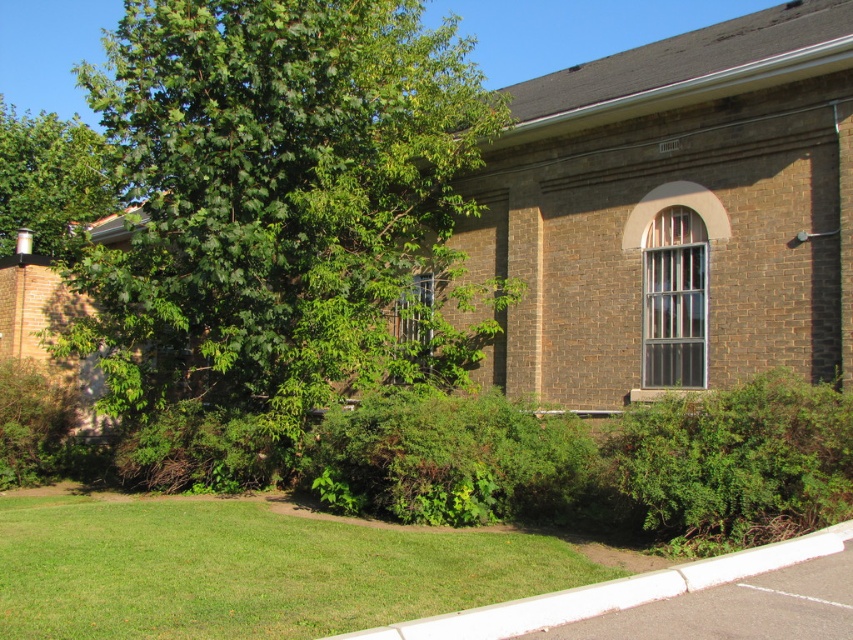
Question: Which object is positioned farthest from the green leafy bush at center?

Choices:
 (A) green grass at lower center
 (B) white concrete curb at lower center

Answer: (B)

Question: Where is green leafy bush at lower right located in relation to white concrete curb at lower center in the image?

Choices:
 (A) right
 (B) left

Answer: (A)

Question: Which object appears closest to the camera in this image?

Choices:
 (A) green leafy bush at lower right
 (B) green leafy tree at center
 (C) green grass at lower center
 (D) green leafy bush at center

Answer: (C)

Question: Does green leafy tree at center appear on the right side of green leafy bush at lower right?

Choices:
 (A) no
 (B) yes

Answer: (A)

Question: Which object appears farthest from the camera in this image?

Choices:
 (A) green leafy tree at upper left
 (B) green leafy bush at center
 (C) green leafy bush at lower right

Answer: (A)

Question: Is green leafy tree at center wider than white concrete curb at lower center?

Choices:
 (A) yes
 (B) no

Answer: (A)